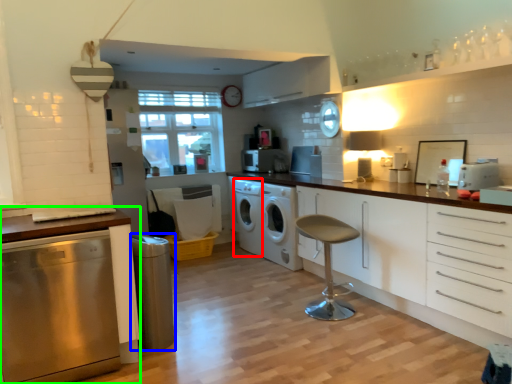
Question: Which object is positioned farthest from washing machine (highlighted by a red box)? Select from appliance (highlighted by a blue box) and cabinetry (highlighted by a green box).

Choices:
 (A) appliance
 (B) cabinetry

Answer: (B)